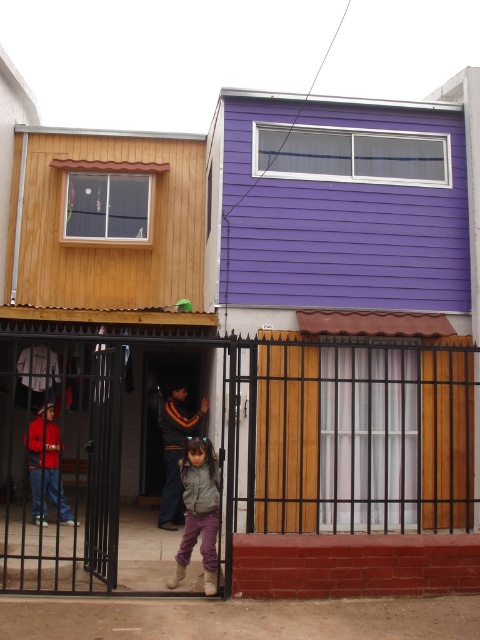
Who is shorter, wooden door at center or matte red jacket at center?

matte red jacket at center

Describe the element at coordinates (165, 412) in the screenshot. I see `wooden door at center` at that location.

Identify the location of wooden door at center. (165, 412).

This screenshot has height=640, width=480. What do you see at coordinates (199, 512) in the screenshot?
I see `gray fuzzy jacket at center` at bounding box center [199, 512].

Is gray fuzzy jacket at center bigger than gray woolen sweater at center?

No, gray fuzzy jacket at center is not bigger than gray woolen sweater at center.

Which is in front, point (213, 506) or point (178, 404)?

Point (213, 506) is more forward.

Find the location of a particular element. Image resolution: width=480 pixels, height=640 pixels. gray fuzzy jacket at center is located at coordinates (199, 512).

Who is shorter, wooden door at center or gray woolen sweater at center?

Standing shorter between the two is gray woolen sweater at center.

Where is `wooden door at center`? This screenshot has width=480, height=640. wooden door at center is located at coordinates (165, 412).

Who is more distant from viewer, (156,472) or (180,456)?

The point (156,472) is more distant.

The image size is (480, 640). Find the location of `wooden door at center`. wooden door at center is located at coordinates (165, 412).